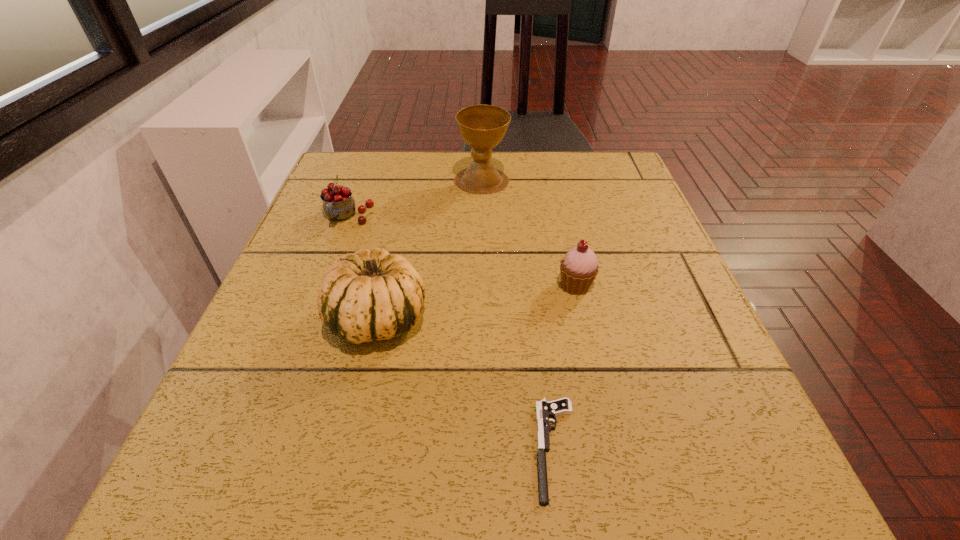
Where is `vacant space at the left edge of the desktop`? The height and width of the screenshot is (540, 960). vacant space at the left edge of the desktop is located at coordinates (293, 251).

The image size is (960, 540). I want to click on vacant point at the right edge, so click(636, 395).

Locate an element on the screen. vacant region at the far left corner is located at coordinates (371, 172).

The width and height of the screenshot is (960, 540). In order to click on vacant space at the far right corner in this screenshot , I will do `click(616, 166)`.

Where is `vacant space at the near right corner of the desktop`? The image size is (960, 540). vacant space at the near right corner of the desktop is located at coordinates (767, 477).

This screenshot has width=960, height=540. In order to click on free space between the shortest object and the second tallest object in this screenshot , I will do `click(468, 384)`.

Locate an element on the screen. This screenshot has width=960, height=540. vacant area that lies between the gourd and the pistol is located at coordinates tap(468, 384).

Identify the location of vacant area between the cupcake and the second farthest object. (462, 251).

Locate an element on the screen. Image resolution: width=960 pixels, height=540 pixels. free space between the fourth shortest object and the cupcake is located at coordinates (477, 302).

Identify the location of free space between the second farthest object and the third object from left to right. The height and width of the screenshot is (540, 960). (415, 199).